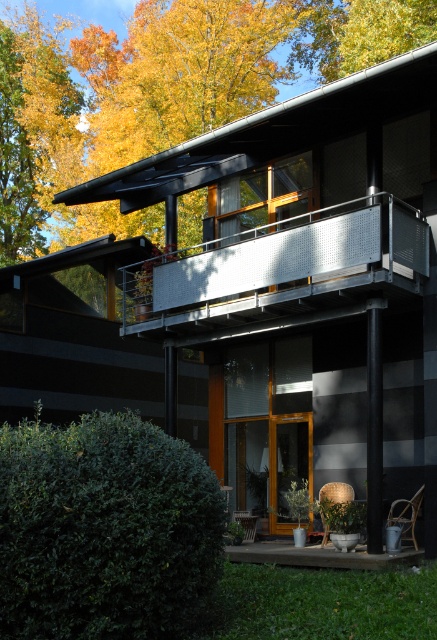
You are planning to host a small garden party and need to decide where to place the buffet table. The buffet table requires a space that is wider than 2 meters. Based on the scene, which location between the metallic silver balcony at upper center and the concrete deck at lower center would be suitable for placing the buffet table?

The concrete deck at lower center would be suitable for placing the buffet table because it has a greater width than the metallic silver balcony at upper center, as stated in the objects description. Since the balcony is narrower, the deck can accommodate the wider buffet table requirement.

You are standing at the entrance of the building and looking towards the metallic silver balcony at upper center. What are the coordinates of the balcony?

The coordinates of the metallic silver balcony at upper center are point (278, 272).

From the picture: You are a maintenance worker needing to inspect the space between the metallic silver balcony at upper center and the concrete deck at lower center. Your ladder is 3.5 meters long. Can you safely reach the gap using this ladder?

The distance between the metallic silver balcony at upper center and the concrete deck at lower center is 3.92 meters. Since the ladder is only 3.5 meters long, it is not long enough to safely bridge the gap between them.